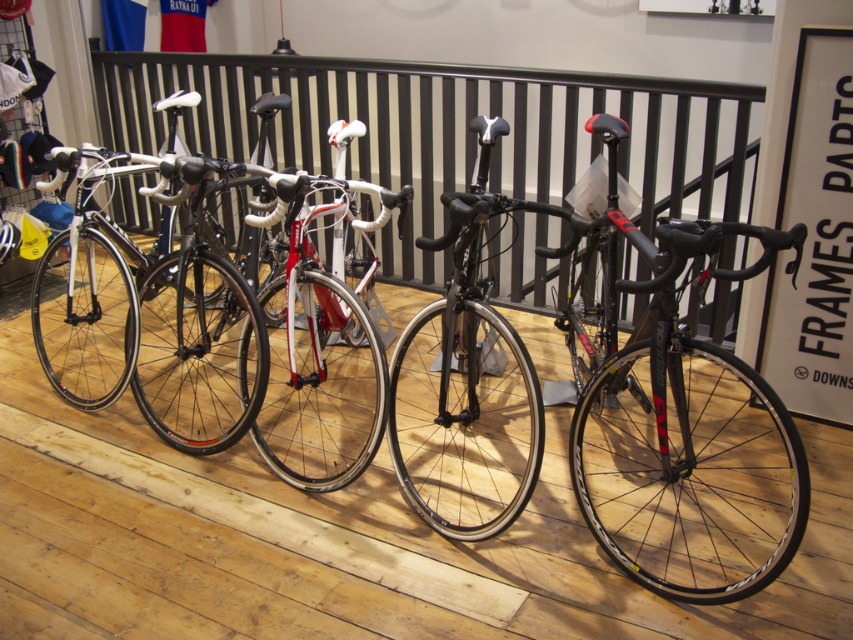
Question: Which point appears farthest from the camera in this image?

Choices:
 (A) click(x=251, y=320)
 (B) click(x=318, y=68)
 (C) click(x=271, y=428)
 (D) click(x=694, y=422)

Answer: (B)

Question: Does black metal balustrade at center have a greater width compared to matte black bike at center?

Choices:
 (A) yes
 (B) no

Answer: (A)

Question: Which of the following is the farthest from the observer?

Choices:
 (A) shiny red bike at center
 (B) shiny black bike at center
 (C) matte black bike at center

Answer: (C)

Question: Which point is farther from the camera taking this photo?

Choices:
 (A) (277, 352)
 (B) (517, 481)
 (C) (647, 429)

Answer: (A)

Question: Is black metal balustrade at center to the left of black matte bicycle at center from the viewer's perspective?

Choices:
 (A) yes
 (B) no

Answer: (A)

Question: Can you confirm if shiny red bike at center is positioned below matte black bike at center?

Choices:
 (A) yes
 (B) no

Answer: (B)